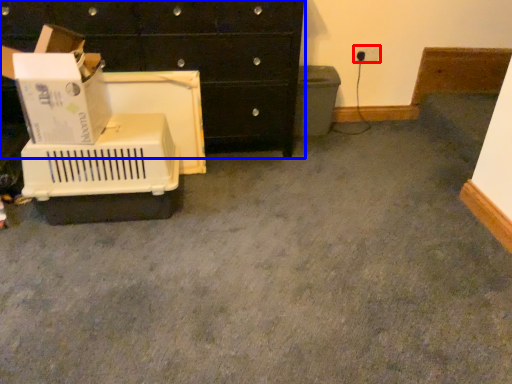
Question: Which point is further to the camera, electric outlet (highlighted by a red box) or chest of drawers (highlighted by a blue box)?

Choices:
 (A) electric outlet
 (B) chest of drawers

Answer: (A)